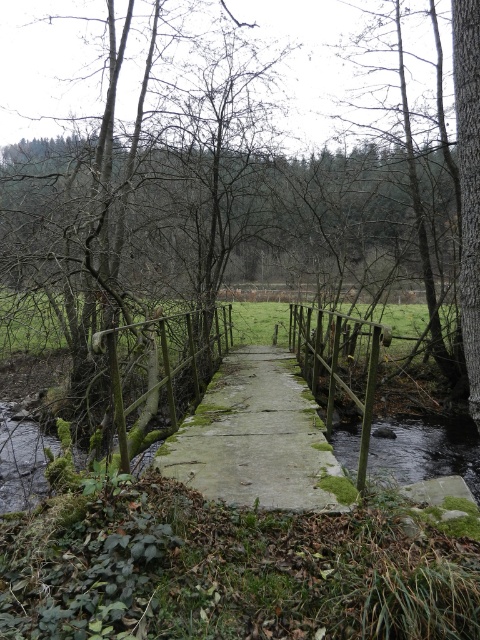
Does point (379, 266) come in front of point (296, 458)?

No, it is not.

Is green mossy tree at center wider than mossy concrete bridge at center?

Correct, the width of green mossy tree at center exceeds that of mossy concrete bridge at center.

Measure the distance between green mossy tree at center and camera.

A distance of 5.17 meters exists between green mossy tree at center and camera.

Find the location of `green mossy tree at center`. green mossy tree at center is located at coordinates (244, 195).